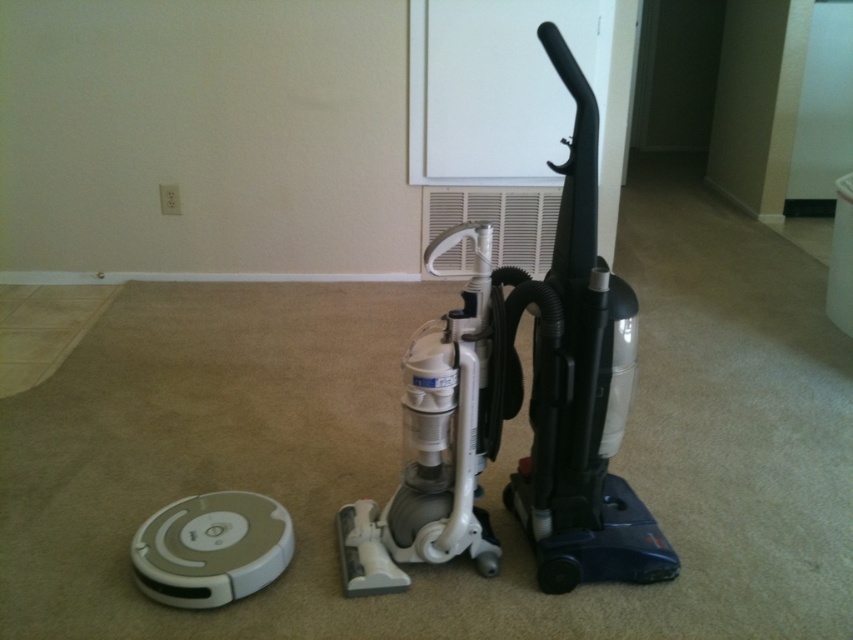
From the picture: Does white plastic robot vacuum cleaner at lower left have a greater width compared to white plastic air conditioner at center?

No, white plastic robot vacuum cleaner at lower left is not wider than white plastic air conditioner at center.

Measure the distance between white plastic robot vacuum cleaner at lower left and white plastic air conditioner at center.

2.03 meters

I want to click on white plastic robot vacuum cleaner at lower left, so click(212, 548).